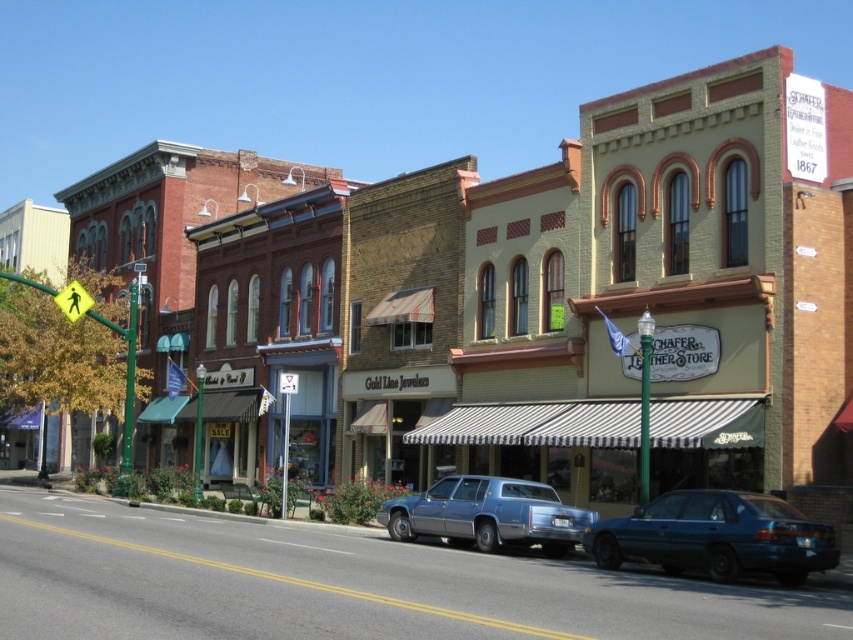
You are a delivery driver who needs to park your vehicle in this street. You see the teal metallic sedan at center and the metallic blue sedan at center. Which vehicle is blocking the parking spot you want to take?

The teal metallic sedan at center is positioned over the metallic blue sedan at center, so it is blocking the parking spot.

You are a delivery driver who needs to park your vehicle between the teal metallic sedan at center and the metallic blue sedan at center. Your vehicle is 1.8 meters tall. Can you safely park there without damaging the vehicles?

The teal metallic sedan at center is taller than the metallic blue sedan at center. Since the teal metallic sedan at center is taller, it is likely that the parking space between them can accommodate your vehicle of 1.8 meters in height. However, you should ensure there is enough vertical clearance between both vehicles to avoid contact. If the space allows, parking should be safe.